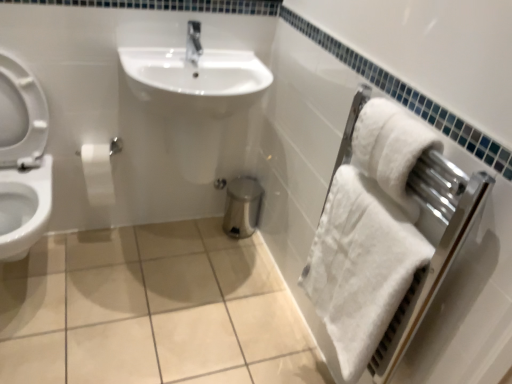
The width and height of the screenshot is (512, 384). What are the coordinates of `empty space that is ontop of white soft towel at right (from a real-world perspective)` in the screenshot? It's located at (424, 134).